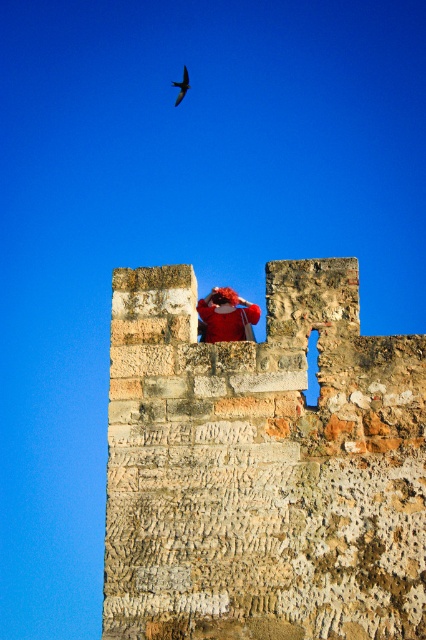
Question: Among these objects, which one is farthest from the camera?

Choices:
 (A) rusty stone fort at center
 (B) smooth black bird at upper center

Answer: (B)

Question: Which point appears closest to the camera in this image?

Choices:
 (A) (187, 77)
 (B) (371, 454)

Answer: (B)

Question: Can you confirm if rusty stone fort at center is wider than smooth black bird at upper center?

Choices:
 (A) yes
 (B) no

Answer: (A)

Question: Is rusty stone fort at center behind smooth black bird at upper center?

Choices:
 (A) no
 (B) yes

Answer: (A)

Question: Among these objects, which one is farthest from the camera?

Choices:
 (A) rusty stone fort at center
 (B) smooth black bird at upper center

Answer: (B)

Question: Is rusty stone fort at center to the left of smooth black bird at upper center from the viewer's perspective?

Choices:
 (A) no
 (B) yes

Answer: (A)